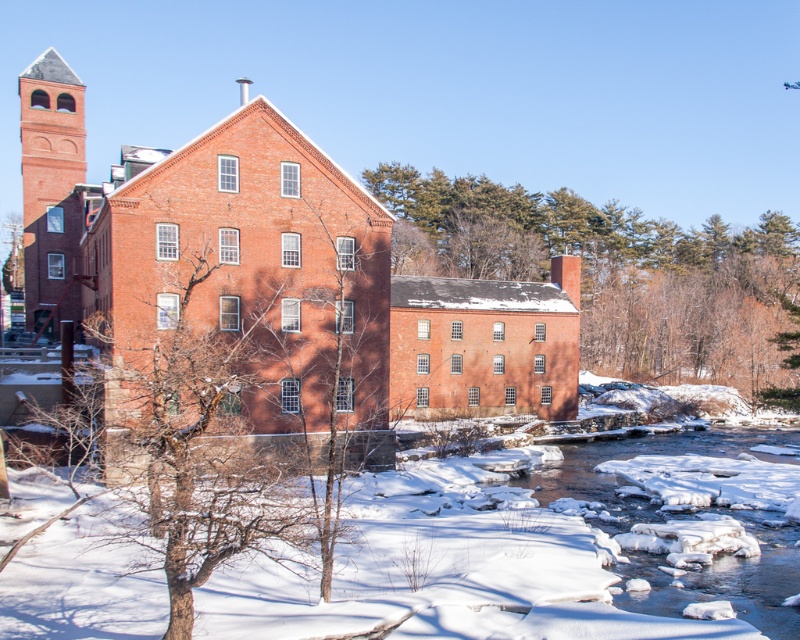
Does brick building at center appear over smooth brown tree trunk at center?

Incorrect, brick building at center is not positioned above smooth brown tree trunk at center.

Is point (320, 256) behind point (414, 202)?

No, (320, 256) is in front of (414, 202).

Is point (514, 282) behind point (748, 288)?

No.

Find the location of a particular element. brick building at center is located at coordinates (274, 282).